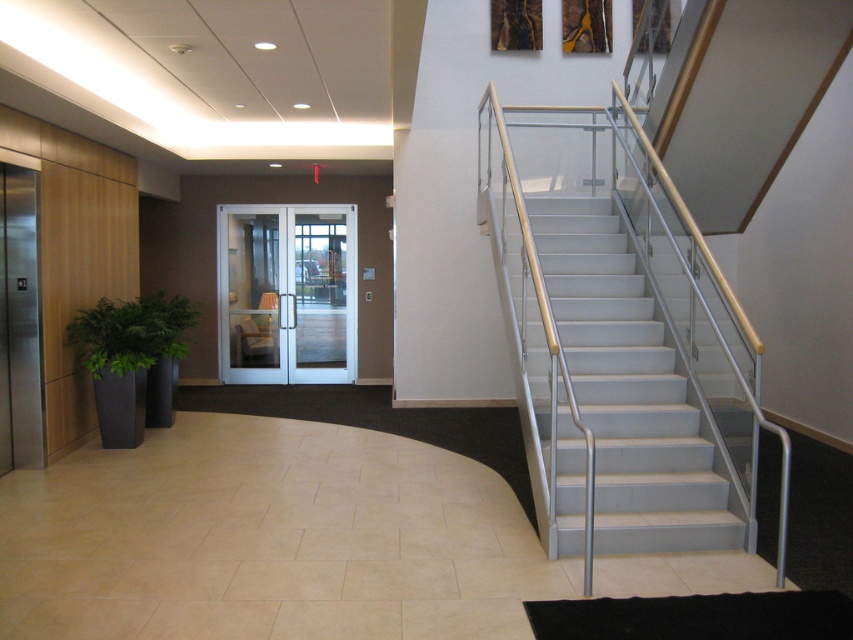
Question: Which point appears closest to the camera in this image?

Choices:
 (A) (279, 378)
 (B) (589, 232)

Answer: (B)

Question: Among these points, which one is nearest to the camera?

Choices:
 (A) (683, 465)
 (B) (218, 355)

Answer: (A)

Question: Does white glass elevator at center have a greater width compared to green leafy plant at left?

Choices:
 (A) yes
 (B) no

Answer: (A)

Question: Is white glossy stairs at right to the right of green leafy plant at left from the viewer's perspective?

Choices:
 (A) yes
 (B) no

Answer: (A)

Question: Considering the relative positions of white glossy stairs at right and white glass elevator at center in the image provided, where is white glossy stairs at right located with respect to white glass elevator at center?

Choices:
 (A) left
 (B) right

Answer: (B)

Question: Which object is positioned farthest from the green leafy plant at left?

Choices:
 (A) white glass elevator at center
 (B) white glossy stairs at right

Answer: (B)